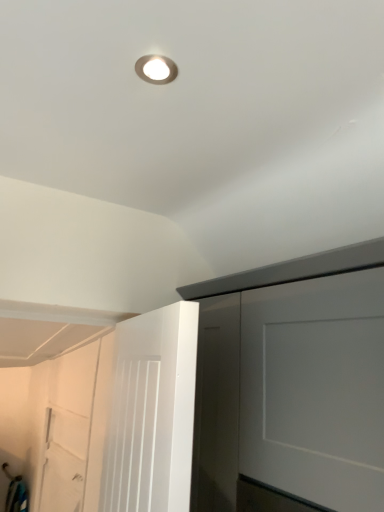
Question: From a real-world perspective, does white matte door at lower left sit lower than white matte door at lower left?

Choices:
 (A) yes
 (B) no

Answer: (B)

Question: Is white matte door at lower left oriented away from white matte door at lower left?

Choices:
 (A) no
 (B) yes

Answer: (A)

Question: Is white matte door at lower left inside white matte door at lower left?

Choices:
 (A) yes
 (B) no

Answer: (B)

Question: Is white matte door at lower left far from white matte door at lower left?

Choices:
 (A) no
 (B) yes

Answer: (B)

Question: Is white matte door at lower left to the right of white matte door at lower left from the viewer's perspective?

Choices:
 (A) yes
 (B) no

Answer: (A)

Question: Considering the relative sizes of white matte door at lower left and white matte door at lower left in the image provided, is white matte door at lower left wider than white matte door at lower left?

Choices:
 (A) no
 (B) yes

Answer: (B)

Question: Is white matte door at lower left next to matte silver droplight at upper center and touching it?

Choices:
 (A) yes
 (B) no

Answer: (B)

Question: Is white matte door at lower left positioned in front of matte silver droplight at upper center?

Choices:
 (A) yes
 (B) no

Answer: (A)

Question: From a real-world perspective, is white matte door at lower left positioned over matte silver droplight at upper center based on gravity?

Choices:
 (A) no
 (B) yes

Answer: (A)

Question: Is white matte door at lower left further to the viewer compared to matte silver droplight at upper center?

Choices:
 (A) yes
 (B) no

Answer: (B)

Question: Is matte silver droplight at upper center inside white matte door at lower left?

Choices:
 (A) no
 (B) yes

Answer: (A)

Question: Could you tell me if white matte door at lower left is turned towards matte silver droplight at upper center?

Choices:
 (A) no
 (B) yes

Answer: (A)

Question: Does matte silver droplight at upper center come behind white matte door at lower left?

Choices:
 (A) no
 (B) yes

Answer: (A)